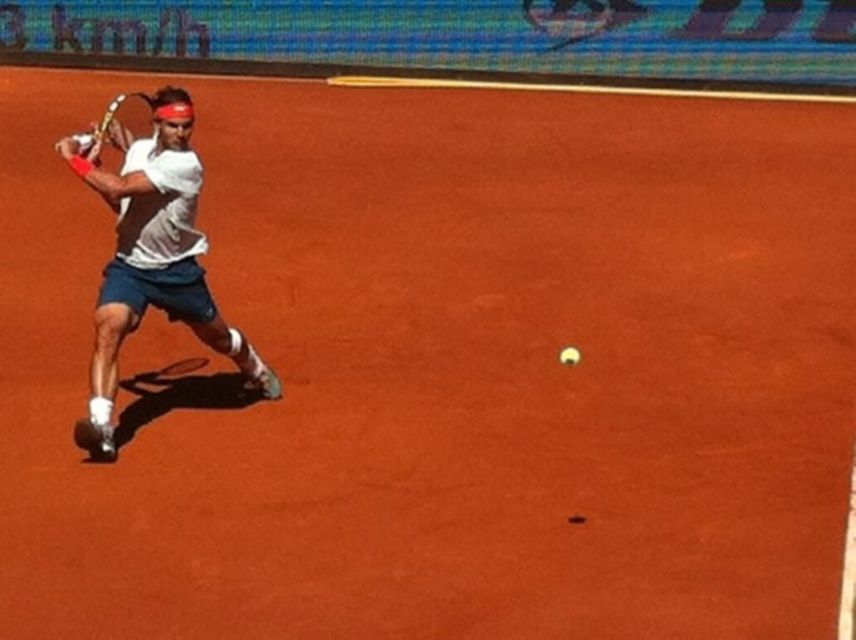
You are a photographer standing at the camera position. You want to capture a closeup shot of the white cotton shirt at left. Considering the distance, is it possible to achieve this without moving closer?

The white cotton shirt at left is 22.15 feet away from camera, so it is possible to achieve a closeup shot without moving closer by using a zoom lens.

You are a tennis coach observing a player wearing a white cotton shirt at left practicing on a clay court. You notice a yellow matte tennis ball at center. Can the player reach the ball before it bounces a second time if they sprint directly towards it at a speed of 7 meters per second? The ball is 1 meter above the ground and will bounce again in 0.8 seconds.

The distance between the white cotton shirt at left and the yellow matte tennis ball at center is 3.01 meters. At a sprinting speed of 7 meters per second, the player can cover the distance in approximately 0.43 seconds. Since the ball will bounce again in 0.8 seconds, the player has enough time to reach the ball before the second bounce.